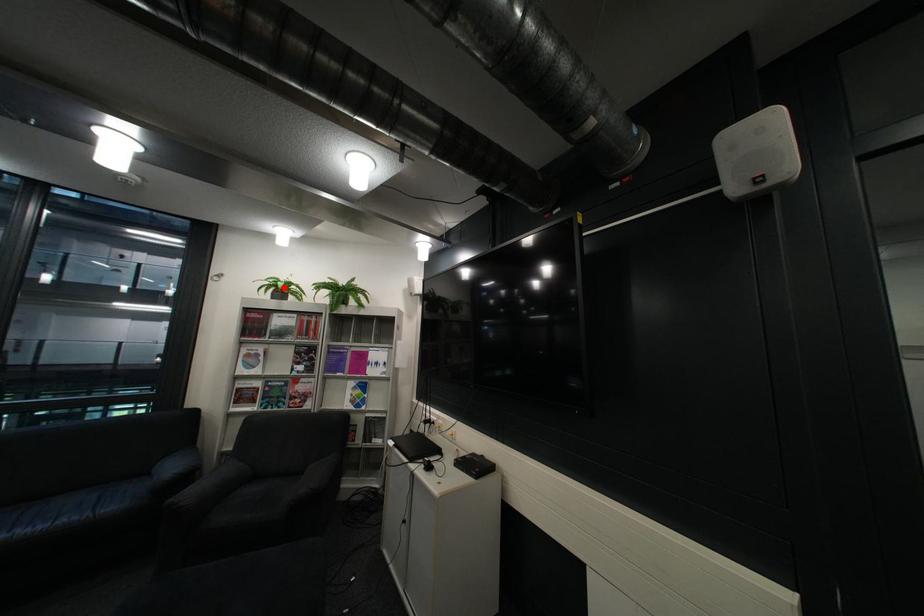
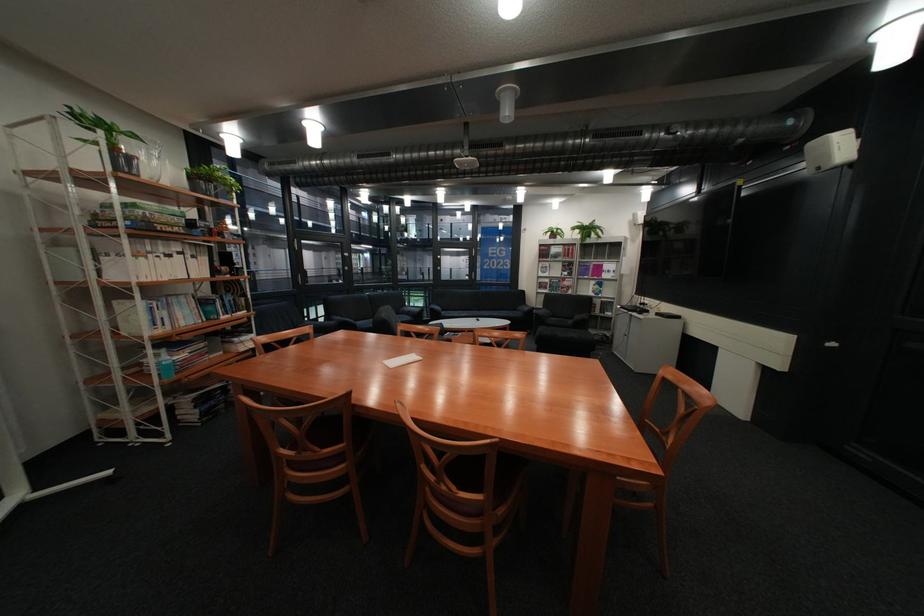
Where in the second image is the point corresponding to the highlighted location from the first image?

(562, 233)